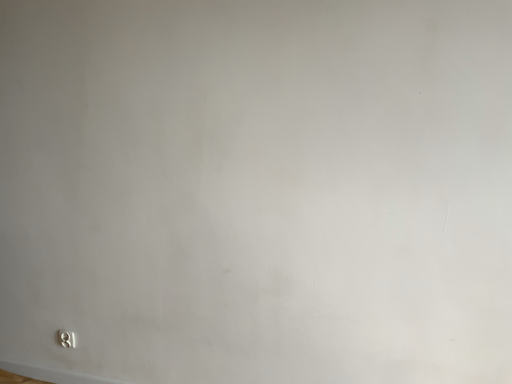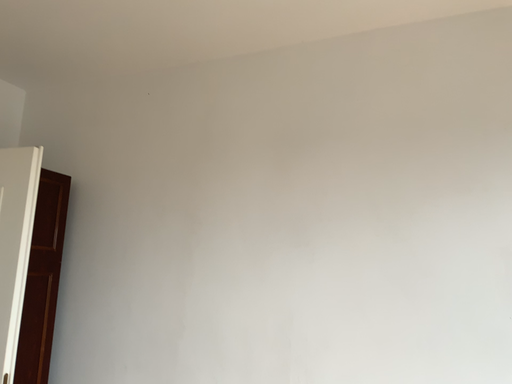
Question: Which way did the camera rotate in the video?

Choices:
 (A) rotated downward
 (B) rotated upward

Answer: (B)